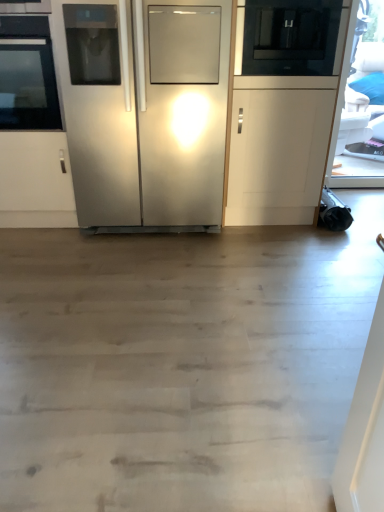
Identify the location of black glass microwave at upper right. (292, 37).

Identify the location of stainless steel refrigerator at center. Image resolution: width=384 pixels, height=512 pixels. (154, 120).

Can you confirm if black glass microwave at upper right is wider than black glass oven at left?

Yes, black glass microwave at upper right is wider than black glass oven at left.

The image size is (384, 512). In order to click on oven that appears on the left of black glass microwave at upper right in this screenshot , I will do `click(27, 74)`.

Between point (247, 49) and point (50, 68), which one is positioned behind?

Point (247, 49)

Which point is more forward, (121, 137) or (273, 54)?

The point (273, 54) is closer.

Which object is thinner, stainless steel refrigerator at center or black glass microwave at upper right?

Thinner between the two is black glass microwave at upper right.

From the image's perspective, is stainless steel refrigerator at center above black glass microwave at upper right?

No, from the image's perspective, stainless steel refrigerator at center is not over black glass microwave at upper right.

Is black glass oven at left far from black glass microwave at upper right?

That's right, there is a large distance between black glass oven at left and black glass microwave at upper right.

Is black glass oven at left at the right side of black glass microwave at upper right?

In fact, black glass oven at left is to the left of black glass microwave at upper right.

From the image's perspective, does black glass oven at left appear lower than black glass microwave at upper right?

Indeed, from the image's perspective, black glass oven at left is shown beneath black glass microwave at upper right.

Does black glass oven at left have a lesser height compared to stainless steel refrigerator at center?

Correct, black glass oven at left is not as tall as stainless steel refrigerator at center.

Consider the image. Could you tell me if black glass oven at left is turned towards stainless steel refrigerator at center?

No, black glass oven at left does not turn towards stainless steel refrigerator at center.

From a real-world perspective, who is located higher, black glass oven at left or stainless steel refrigerator at center?

In real-world perspective, black glass oven at left is above.

Is point (50, 121) closer or farther from the camera than point (116, 190)?

Point (50, 121) is positioned closer to the camera compared to point (116, 190).

From the picture: Is there a large distance between stainless steel refrigerator at center and black glass oven at left?

Actually, stainless steel refrigerator at center and black glass oven at left are a little close together.

Considering the sizes of objects stainless steel refrigerator at center and black glass oven at left in the image provided, who is bigger, stainless steel refrigerator at center or black glass oven at left?

stainless steel refrigerator at center.

From a real-world perspective, is stainless steel refrigerator at center above or below black glass oven at left?

In terms of real-world spatial position, stainless steel refrigerator at center is below black glass oven at left.

Which is correct: stainless steel refrigerator at center is inside black glass oven at left, or outside of it?

stainless steel refrigerator at center is outside black glass oven at left.

Which object is positioned more to the left, black glass microwave at upper right or stainless steel refrigerator at center?

stainless steel refrigerator at center.

In terms of height, does black glass microwave at upper right look taller or shorter compared to stainless steel refrigerator at center?

Clearly, black glass microwave at upper right is shorter compared to stainless steel refrigerator at center.

Which object is thinner, black glass microwave at upper right or stainless steel refrigerator at center?

black glass microwave at upper right.

Is black glass microwave at upper right located outside stainless steel refrigerator at center?

Yes, black glass microwave at upper right is located beyond the bounds of stainless steel refrigerator at center.

I want to click on oven below the black glass microwave at upper right (from a real-world perspective), so click(27, 74).

This screenshot has width=384, height=512. Identify the location of appliance that appears above the stainless steel refrigerator at center (from the image's perspective). (292, 37).

When comparing their distances from black glass microwave at upper right, does stainless steel refrigerator at center or black glass oven at left seem closer?

stainless steel refrigerator at center.

When comparing their distances from black glass microwave at upper right, does black glass oven at left or stainless steel refrigerator at center seem further?

black glass oven at left lies further to black glass microwave at upper right than the other object.

Looking at the image, which one is located closer to stainless steel refrigerator at center, black glass microwave at upper right or black glass oven at left?

black glass oven at left lies closer to stainless steel refrigerator at center than the other object.

Looking at the image, which one is located further to stainless steel refrigerator at center, black glass oven at left or black glass microwave at upper right?

black glass microwave at upper right is further to stainless steel refrigerator at center.

Estimate the real-world distances between objects in this image. Which object is closer to black glass oven at left, stainless steel refrigerator at center or black glass microwave at upper right?

stainless steel refrigerator at center lies closer to black glass oven at left than the other object.

From the picture: When comparing their distances from black glass oven at left, does black glass microwave at upper right or stainless steel refrigerator at center seem further?

black glass microwave at upper right is positioned further to the anchor black glass oven at left.

This screenshot has width=384, height=512. What are the coordinates of `refrigerator between black glass oven at left and black glass microwave at upper right` in the screenshot? It's located at (154, 120).